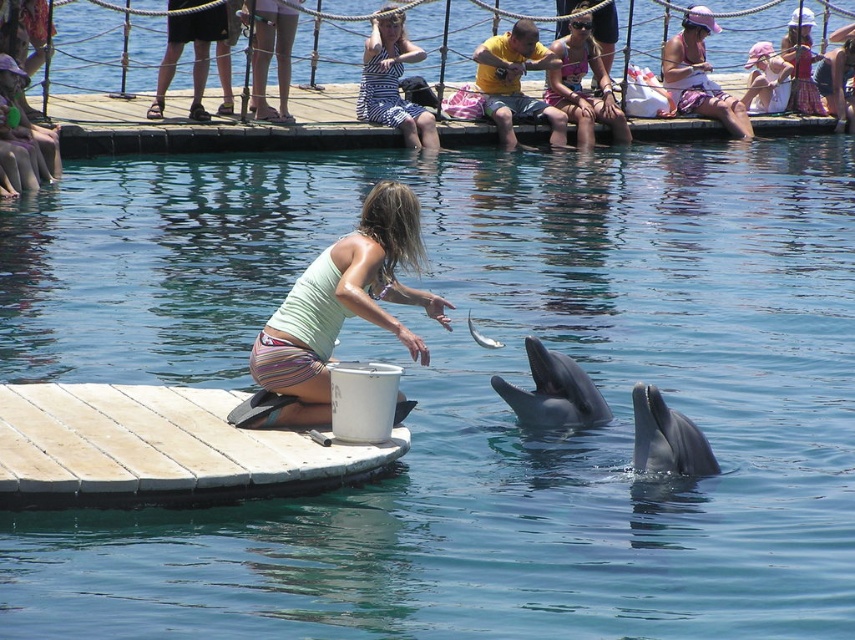
You are a photographer trying to capture the woman in the striped dress at the dolphin interaction event. The event organizers have specified that you must position your camera exactly at the point marked as point (392,83). Can you confirm if this point is located on the white striped dress at upper center?

Yes, the point (392,83) is located on the white striped dress at upper center as described in the scene description.